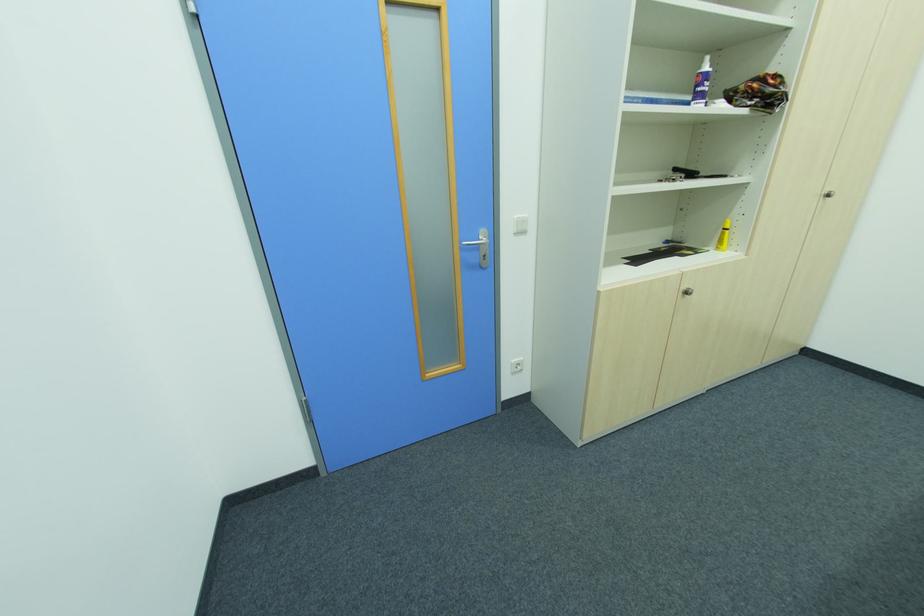
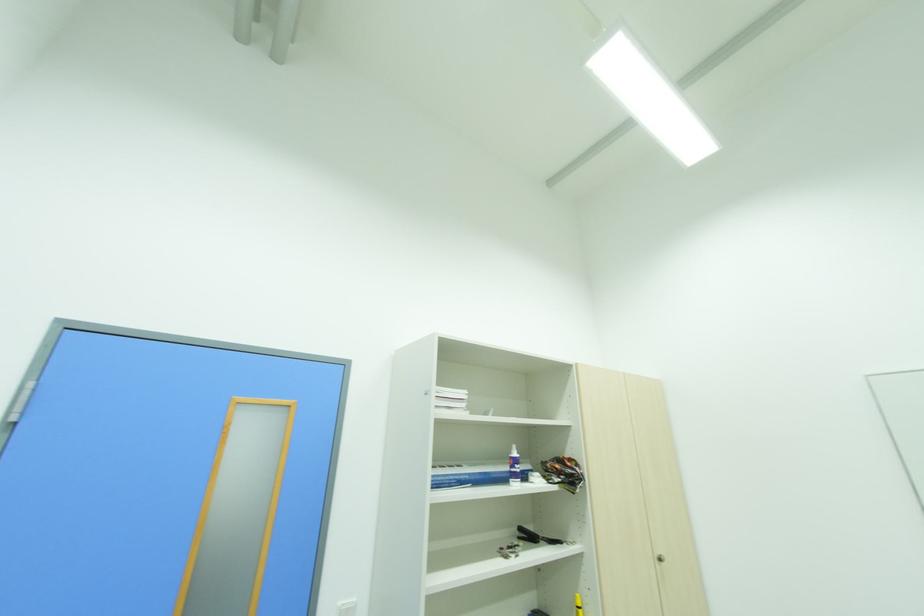
Question: How did the camera likely rotate?

Choices:
 (A) Left
 (B) Right
 (C) Up
 (D) Down

Answer: (C)